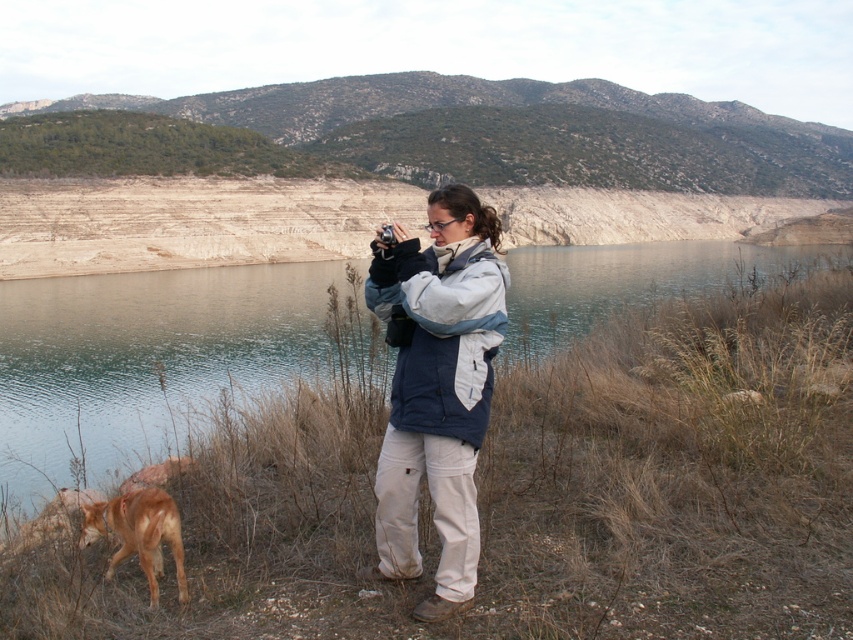
Question: Is clear water at center closer to camera compared to brown fur dog at lower left?

Choices:
 (A) no
 (B) yes

Answer: (A)

Question: Which object is farther from the camera taking this photo?

Choices:
 (A) clear water at center
 (B) brown fur dog at lower left

Answer: (A)

Question: Is clear water at center in front of brown fur dog at lower left?

Choices:
 (A) no
 (B) yes

Answer: (A)

Question: Is clear water at center above brown fur dog at lower left?

Choices:
 (A) yes
 (B) no

Answer: (A)

Question: Which object appears closest to the camera in this image?

Choices:
 (A) brown fur dog at lower left
 (B) clear water at center

Answer: (A)

Question: Which object is farther from the camera taking this photo?

Choices:
 (A) clear water at center
 (B) brown fur dog at lower left

Answer: (A)